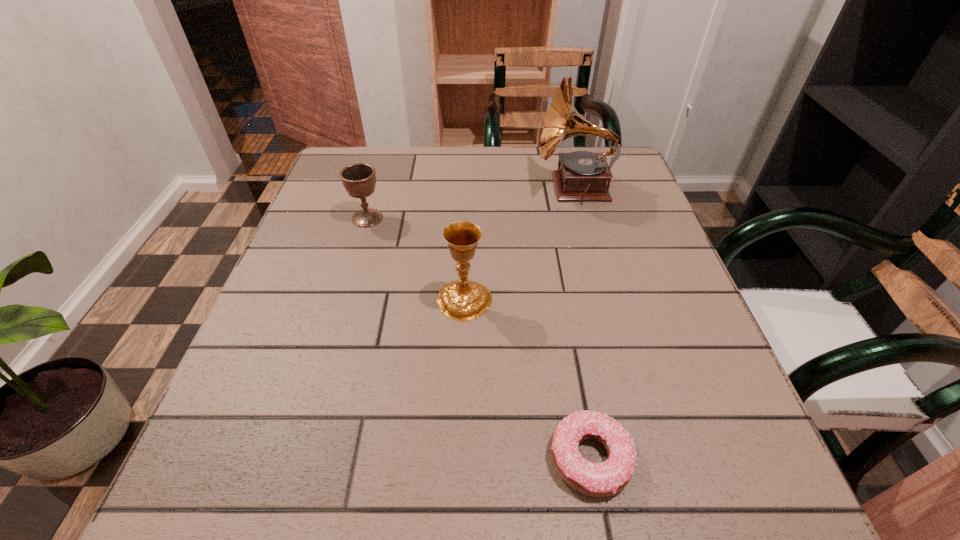
Identify the location of vacant space located 0.050m on the left of the third object from right to left. The width and height of the screenshot is (960, 540). (411, 300).

Find the location of a particular element. This screenshot has width=960, height=540. vacant space situated 0.130m on the front of the farther chalice is located at coordinates (352, 268).

The height and width of the screenshot is (540, 960). I want to click on free space located 0.210m on the back of the nearest object, so click(x=564, y=314).

At what (x,y) coordinates should I click in order to perform the action: click on object at the far edge. Please return your answer as a coordinate pair (x, y). Looking at the image, I should click on (583, 175).

Where is `object situated at the near edge`? The width and height of the screenshot is (960, 540). object situated at the near edge is located at coordinates (608, 478).

You are a GUI agent. You are given a task and a screenshot of the screen. Output one action in this format:
    pyautogui.click(x=<x>, y=<y>)
    Task: Click on the object present at the left edge
    The image size is (960, 540).
    Given the screenshot: What is the action you would take?
    pyautogui.click(x=359, y=179)

This screenshot has height=540, width=960. Identify the location of object present at the right edge. (583, 175).

Where is `object that is at the far right corner`? The image size is (960, 540). object that is at the far right corner is located at coordinates (583, 175).

Find the location of a particular element. The width and height of the screenshot is (960, 540). vacant space at the far edge of the desktop is located at coordinates (472, 161).

This screenshot has width=960, height=540. In order to click on vacant space at the near edge of the desktop in this screenshot , I will do `click(549, 510)`.